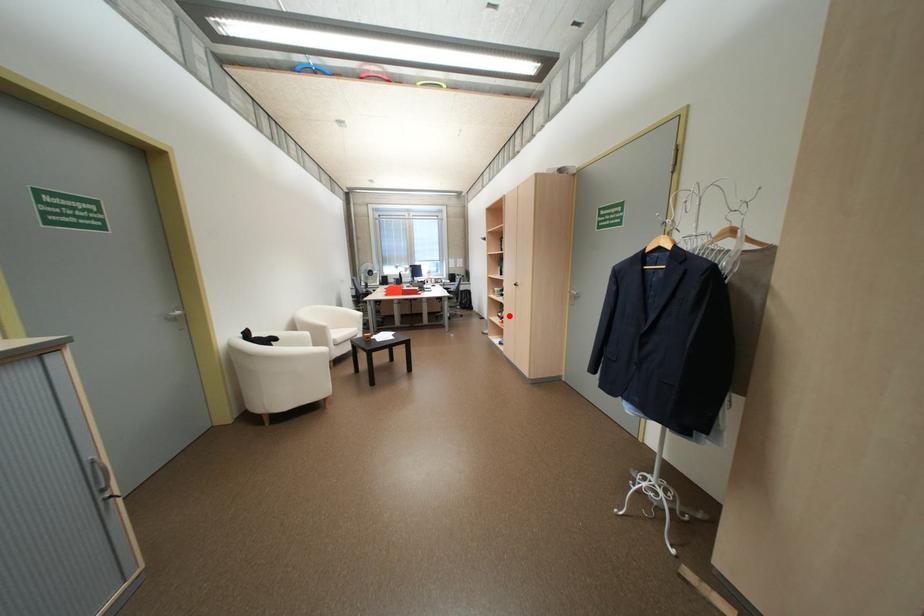
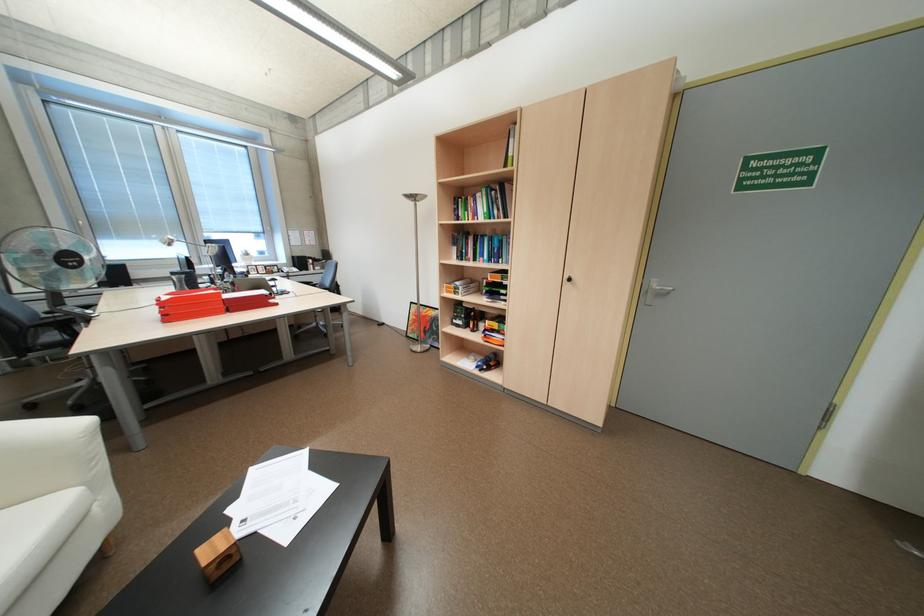
In the second image, find the point that corresponds to the highlighted location in the first image.

(468, 325)